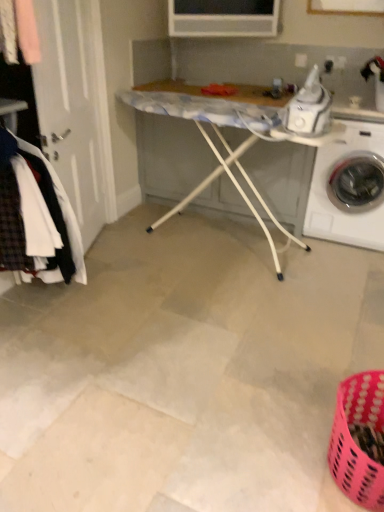
Question: Can you confirm if plaid wool coat at left is positioned to the right of white glossy washing machine at right?

Choices:
 (A) yes
 (B) no

Answer: (B)

Question: Can you confirm if plaid wool coat at left is thinner than white glossy washing machine at right?

Choices:
 (A) no
 (B) yes

Answer: (B)

Question: Can you confirm if plaid wool coat at left is wider than white glossy washing machine at right?

Choices:
 (A) yes
 (B) no

Answer: (B)

Question: From the image's perspective, is plaid wool coat at left over white glossy washing machine at right?

Choices:
 (A) no
 (B) yes

Answer: (A)

Question: From the image's perspective, is plaid wool coat at left located beneath white glossy washing machine at right?

Choices:
 (A) yes
 (B) no

Answer: (A)

Question: Based on their sizes in the image, would you say plaid wool coat at left is bigger or smaller than white tile floor at center?

Choices:
 (A) small
 (B) big

Answer: (A)

Question: From the image's perspective, relative to white tile floor at center, is plaid wool coat at left above or below?

Choices:
 (A) above
 (B) below

Answer: (A)

Question: From a real-world perspective, is plaid wool coat at left physically located above or below white tile floor at center?

Choices:
 (A) below
 (B) above

Answer: (B)

Question: In terms of width, does plaid wool coat at left look wider or thinner when compared to white tile floor at center?

Choices:
 (A) thin
 (B) wide

Answer: (A)

Question: In the image, is white glossy washing machine at right positioned in front of or behind white tile floor at center?

Choices:
 (A) front
 (B) behind

Answer: (B)

Question: Looking at the image, does white glossy washing machine at right seem bigger or smaller compared to white tile floor at center?

Choices:
 (A) big
 (B) small

Answer: (B)

Question: Is point (380, 138) closer or farther from the camera than point (311, 278)?

Choices:
 (A) farther
 (B) closer

Answer: (B)

Question: Is white glossy washing machine at right inside the boundaries of white tile floor at center, or outside?

Choices:
 (A) outside
 (B) inside

Answer: (A)

Question: Is plaid wool coat at left bigger or smaller than white plastic ironing board at center?

Choices:
 (A) big
 (B) small

Answer: (B)

Question: Looking at their shapes, would you say plaid wool coat at left is wider or thinner than white plastic ironing board at center?

Choices:
 (A) wide
 (B) thin

Answer: (A)